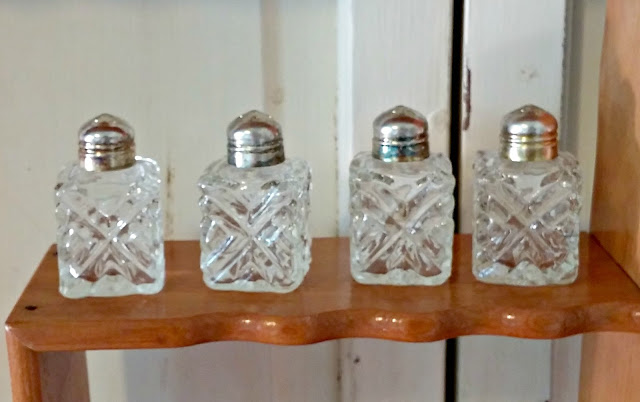
Find the location of a particular element. door is located at coordinates (612, 347).